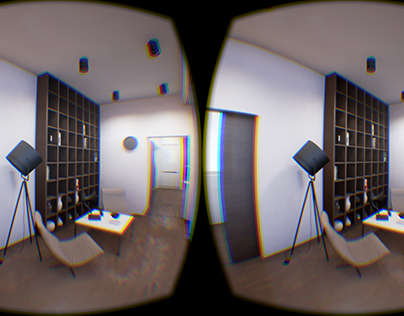
Where is `hallway`? The width and height of the screenshot is (404, 316). hallway is located at coordinates (173, 198).